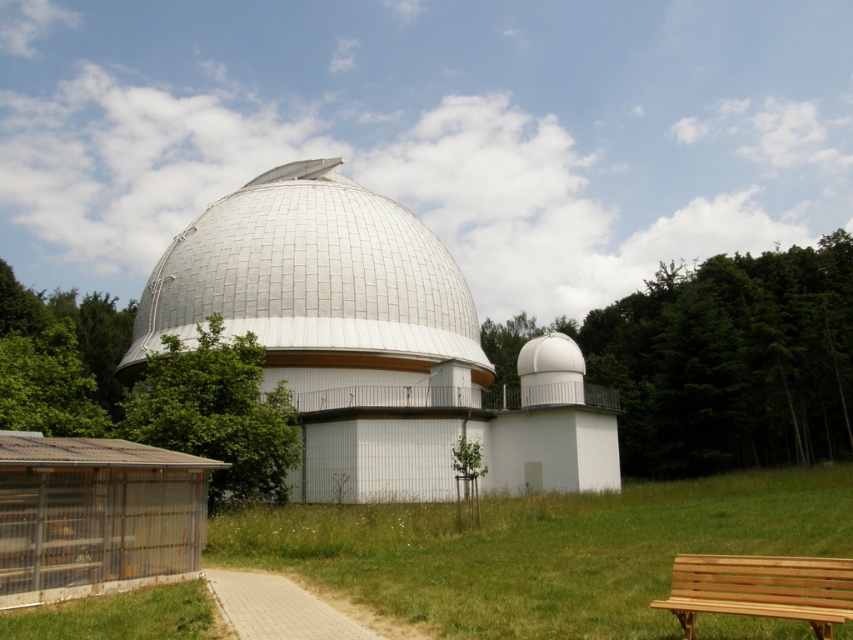
Question: Where is white textured dome at center located in relation to brown wooden bench at lower right in the image?

Choices:
 (A) above
 (B) below

Answer: (A)

Question: Which point is closer to the camera?

Choices:
 (A) green grass at center
 (B) white matte observatory at center

Answer: (A)

Question: Which point appears closest to the camera in this image?

Choices:
 (A) (836, 266)
 (B) (323, 618)

Answer: (B)

Question: Where is white matte observatory at center located in relation to green leafy tree at left in the image?

Choices:
 (A) right
 (B) left

Answer: (A)

Question: Can you confirm if white matte observatory at center is wider than green grass at center?

Choices:
 (A) no
 (B) yes

Answer: (A)

Question: Based on their relative distances, which object is nearer to the brown wooden bench at lower right?

Choices:
 (A) green leafy tree at right
 (B) green grass at center
 (C) white matte observatory at center

Answer: (B)